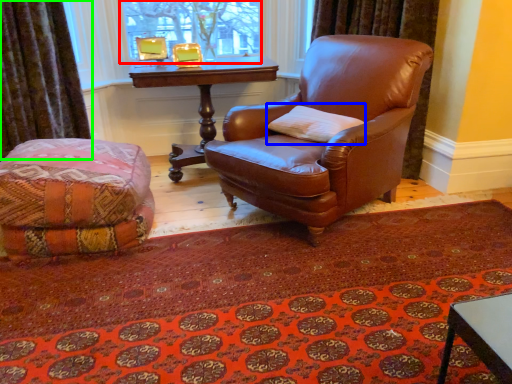
Question: Considering the real-world distances, which object is farthest from bay window (highlighted by a red box)? pillow (highlighted by a blue box) or curtain (highlighted by a green box)?

Choices:
 (A) pillow
 (B) curtain

Answer: (A)